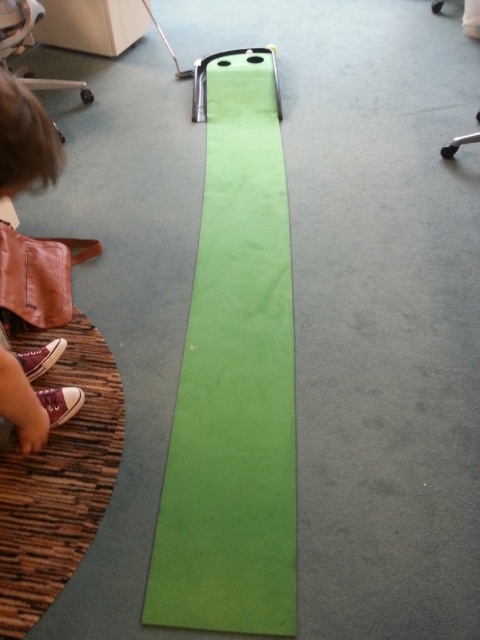
You are playing miniature golf and need to place your ball on the green matte strip at center. According to the image, where exactly should you position your ball?

The green matte strip at center is located at point (233, 380), so you should position your ball there.

You are a robot trying to navigate from the brown leather shoes at lower left to the green matte strip at center. The robot is 50 centimeters wide. Is there enough space to move directly between them?

The green matte strip at center is 80.93 centimeters from the brown leather shoes at lower left. Since the robot is 50 centimeters wide, there is sufficient space between them for the robot to move directly.

You are playing miniature golf and need to place your brown leather shoes at lower left next to the green matte strip at center. Can you fit them side by side without overlapping?

The green matte strip at center has a larger size compared to brown leather shoes at lower left, so they can be placed side by side without overlapping.